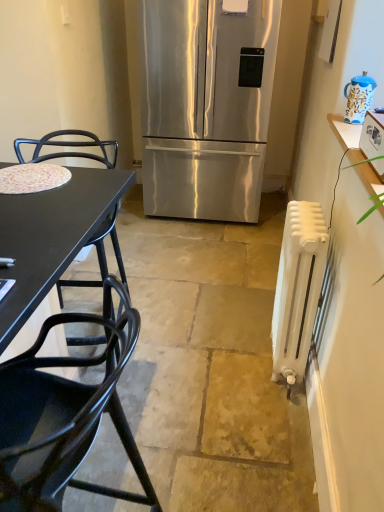
Where is `vacant position to the left of white matte radiator at right`? This screenshot has width=384, height=512. vacant position to the left of white matte radiator at right is located at coordinates (234, 357).